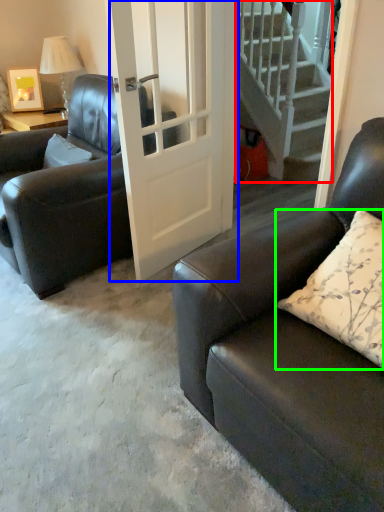
Question: Which object is positioned closest to stairs (highlighted by a red box)? Select from door (highlighted by a blue box) and pillow (highlighted by a green box).

Choices:
 (A) door
 (B) pillow

Answer: (A)